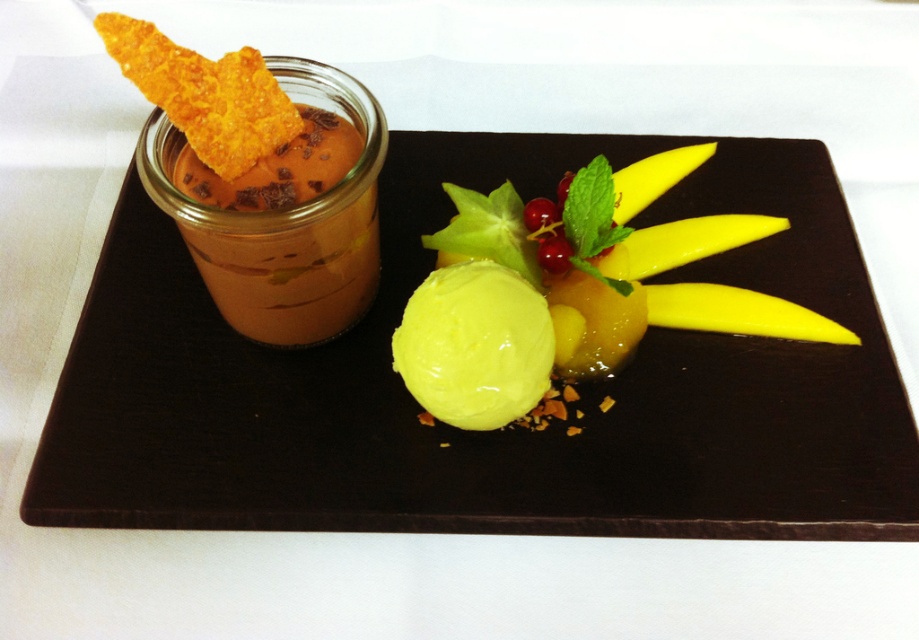
Between matte brown jar at upper left and yellow glossy ice cream at center, which one has more height?

Standing taller between the two is matte brown jar at upper left.

Is matte brown jar at upper left bigger than yellow glossy ice cream at center?

Indeed, matte brown jar at upper left has a larger size compared to yellow glossy ice cream at center.

Between point (78, 403) and point (568, 227), which one is positioned behind?

Positioned behind is point (568, 227).

Locate an element on the screen. matte brown jar at upper left is located at coordinates (496, 429).

Is point (450, 291) closer to camera compared to point (494, 269)?

Yes, point (450, 291) is closer to viewer.

The width and height of the screenshot is (919, 640). I want to click on yellow glossy ice cream at center, so click(568, 300).

Does matte brown jar at upper left appear over yellow smooth ice cream at center?

Correct, matte brown jar at upper left is located above yellow smooth ice cream at center.

Who is taller, matte brown jar at upper left or yellow smooth ice cream at center?

matte brown jar at upper left

Find the location of a particular element. Image resolution: width=919 pixels, height=640 pixels. matte brown jar at upper left is located at coordinates (496, 429).

In order to click on matte brown jar at upper left in this screenshot , I will do `click(496, 429)`.